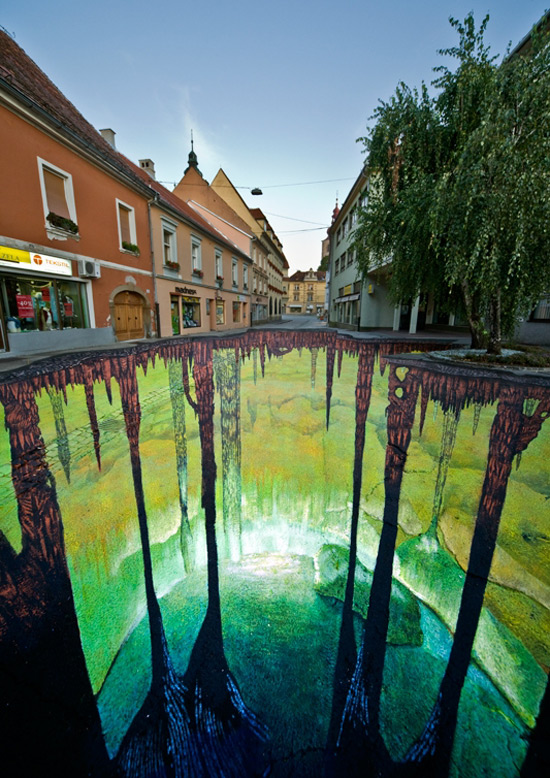
Locate an element on the screen. Image resolution: width=550 pixels, height=778 pixels. doors is located at coordinates (129, 309), (430, 316).